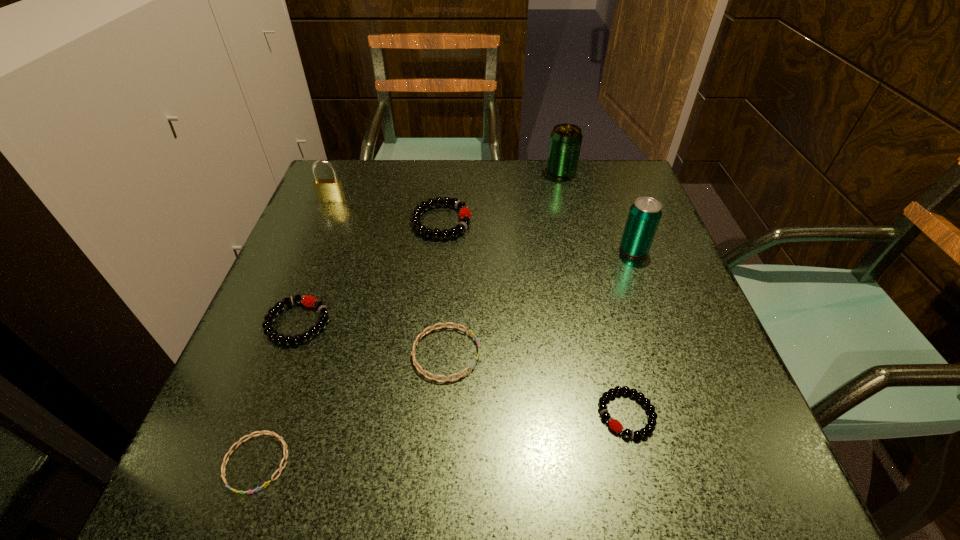
Find the location of `green beer can`. green beer can is located at coordinates (565, 143).

This screenshot has height=540, width=960. Find the location of `the left beer can`. the left beer can is located at coordinates (565, 143).

Locate an element on the screen. This screenshot has width=960, height=540. the rightmost object is located at coordinates (644, 216).

Identify the location of the nearer beer can. (644, 216).

Find the location of `padlock`. padlock is located at coordinates (327, 190).

Locate an element on the screen. The image size is (960, 540). brass padlock is located at coordinates (327, 190).

Where is `the farthest black bracelet`? The image size is (960, 540). the farthest black bracelet is located at coordinates (464, 213).

Locate an element on the screen. The height and width of the screenshot is (540, 960). the second black bracelet from right to left is located at coordinates (464, 213).

Locate an element on the screen. Image resolution: width=960 pixels, height=540 pixels. the leftmost black bracelet is located at coordinates (309, 301).

This screenshot has width=960, height=540. I want to click on the second nearest black bracelet, so 309,301.